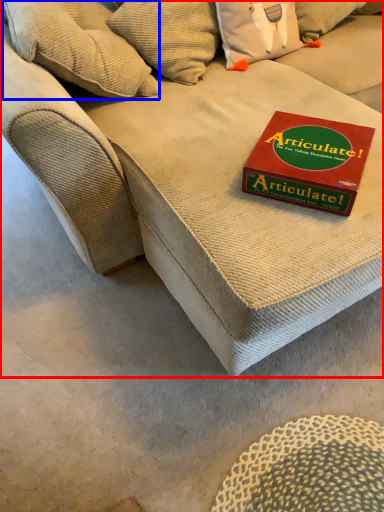
Question: Which object is closer to the camera taking this photo, studio couch (highlighted by a red box) or pillow (highlighted by a blue box)?

Choices:
 (A) studio couch
 (B) pillow

Answer: (A)